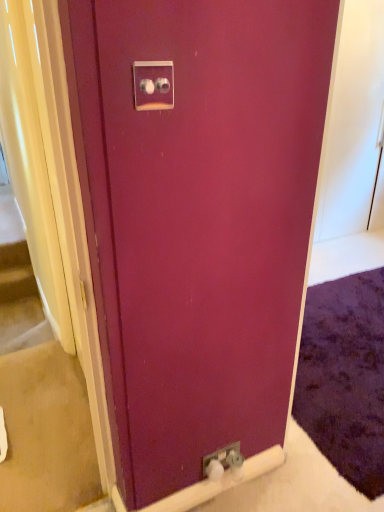
Question: From the image's perspective, would you say metallic silver outlet at lower center, which is the second electric outlet from front to back, is shown under beige carpet at lower left?

Choices:
 (A) no
 (B) yes

Answer: (B)

Question: Considering the relative sizes of metallic silver outlet at lower center, acting as the 2th electric outlet starting from the left, and beige carpet at lower left in the image provided, is metallic silver outlet at lower center, acting as the 2th electric outlet starting from the left, thinner than beige carpet at lower left?

Choices:
 (A) no
 (B) yes

Answer: (B)

Question: Is metallic silver outlet at lower center, which is the second electric outlet from front to back, further to camera compared to beige carpet at lower left?

Choices:
 (A) no
 (B) yes

Answer: (B)

Question: Considering the relative sizes of metallic silver outlet at lower center, the first electric outlet positioned from the bottom, and beige carpet at lower left in the image provided, is metallic silver outlet at lower center, the first electric outlet positioned from the bottom, wider than beige carpet at lower left?

Choices:
 (A) yes
 (B) no

Answer: (B)

Question: Is metallic silver outlet at lower center, the first electric outlet positioned from the bottom, facing away from beige carpet at lower left?

Choices:
 (A) no
 (B) yes

Answer: (A)

Question: From a real-world perspective, is metallic silver outlet at lower center, acting as the 2th electric outlet starting from the left, on beige carpet at lower left?

Choices:
 (A) yes
 (B) no

Answer: (A)

Question: Considering the relative sizes of beige carpet at lower left and satin silver switch at upper center, which ranks as the second electric outlet in right-to-left order, in the image provided, is beige carpet at lower left bigger than satin silver switch at upper center, which ranks as the second electric outlet in right-to-left order,?

Choices:
 (A) no
 (B) yes

Answer: (B)

Question: Can you confirm if beige carpet at lower left is wider than satin silver switch at upper center, which ranks as the second electric outlet in right-to-left order?

Choices:
 (A) yes
 (B) no

Answer: (A)

Question: Is beige carpet at lower left next to satin silver switch at upper center, which is counted as the second electric outlet, starting from the back?

Choices:
 (A) yes
 (B) no

Answer: (B)

Question: Is beige carpet at lower left outside satin silver switch at upper center, marked as the first electric outlet in a left-to-right arrangement?

Choices:
 (A) no
 (B) yes

Answer: (B)

Question: Is beige carpet at lower left aimed at satin silver switch at upper center, marked as the first electric outlet in a left-to-right arrangement?

Choices:
 (A) no
 (B) yes

Answer: (A)

Question: From the image's perspective, is beige carpet at lower left located beneath satin silver switch at upper center, which ranks as the second electric outlet in right-to-left order?

Choices:
 (A) yes
 (B) no

Answer: (A)

Question: From the image's perspective, does satin silver switch at upper center, the second electric outlet from the bottom, appear lower than beige carpet at lower left?

Choices:
 (A) no
 (B) yes

Answer: (A)